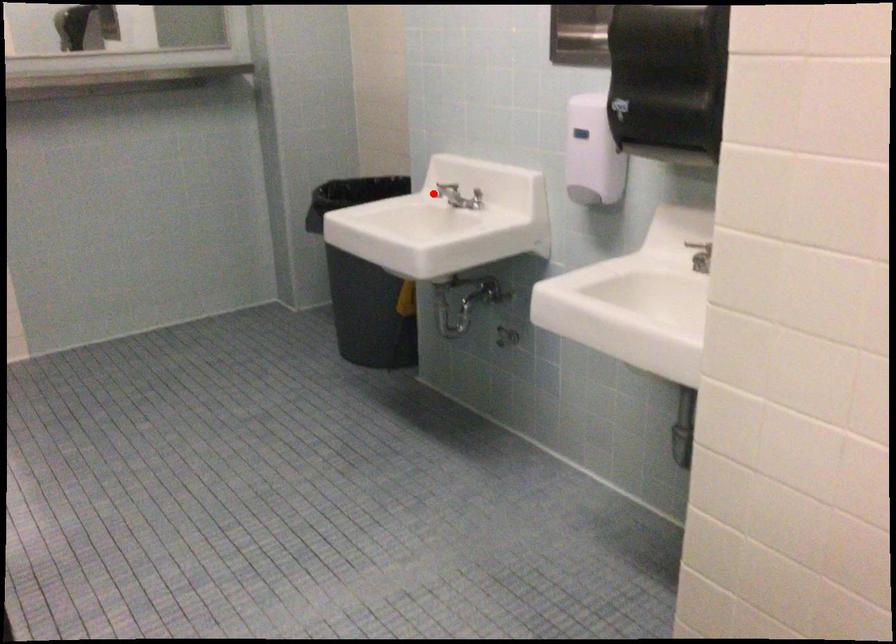
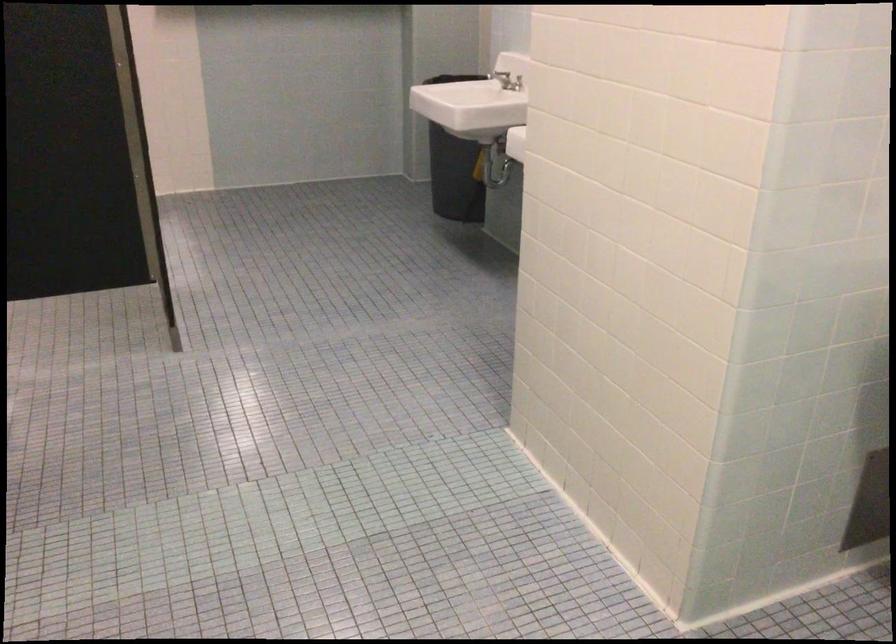
Where in the second image is the point corresponding to the highlighted location from the first image?

(500, 75)